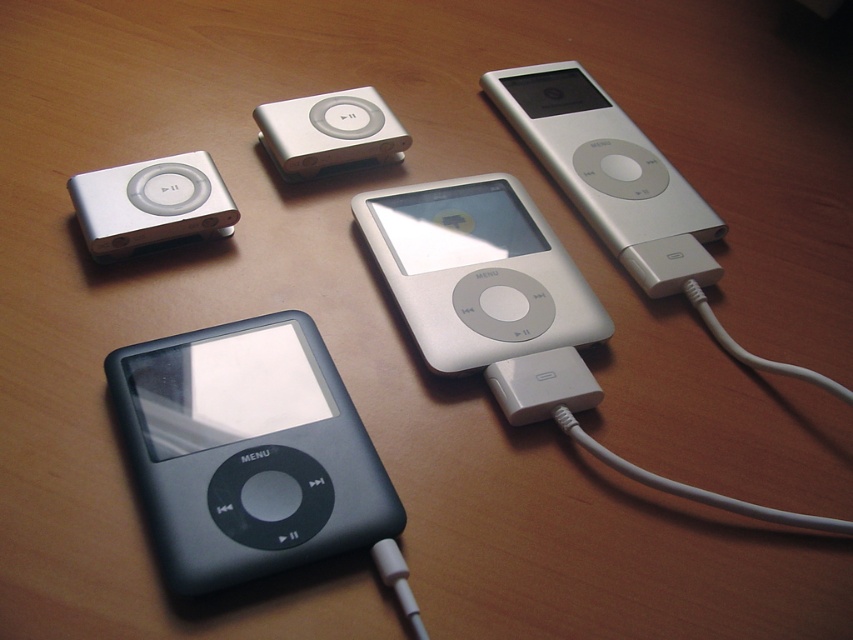
Question: Can you confirm if black matte ipod at lower left is positioned above silver/metallic ipod at upper center?

Choices:
 (A) no
 (B) yes

Answer: (A)

Question: Which object is farther from the camera taking this photo?

Choices:
 (A) black matte ipod at lower left
 (B) silver/metallic ipod at upper center
 (C) satin silver ipod at center
 (D) sleek silver ipod at center-right

Answer: (B)

Question: Is satin silver ipod at center smaller than satin silver ipod at upper left?

Choices:
 (A) no
 (B) yes

Answer: (A)

Question: Which point is closer to the camera?

Choices:
 (A) sleek silver ipod at center-right
 (B) black matte ipod at lower left
 (C) satin silver ipod at upper left

Answer: (B)

Question: Can you confirm if black matte ipod at lower left is wider than silver/metallic ipod at upper center?

Choices:
 (A) no
 (B) yes

Answer: (B)

Question: Estimate the real-world distances between objects in this image. Which object is closer to the satin silver ipod at center?

Choices:
 (A) black matte ipod at lower left
 (B) satin silver ipod at upper left
 (C) sleek silver ipod at center-right
 (D) silver/metallic ipod at upper center

Answer: (C)